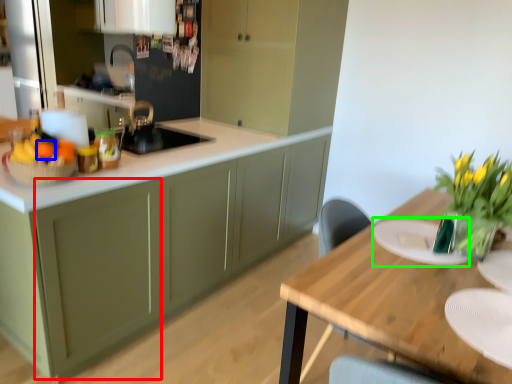
Question: Which is nearer to the cabinetry (highlighted by a red box)? tangerine (highlighted by a blue box) or plate (highlighted by a green box).

Choices:
 (A) tangerine
 (B) plate

Answer: (A)